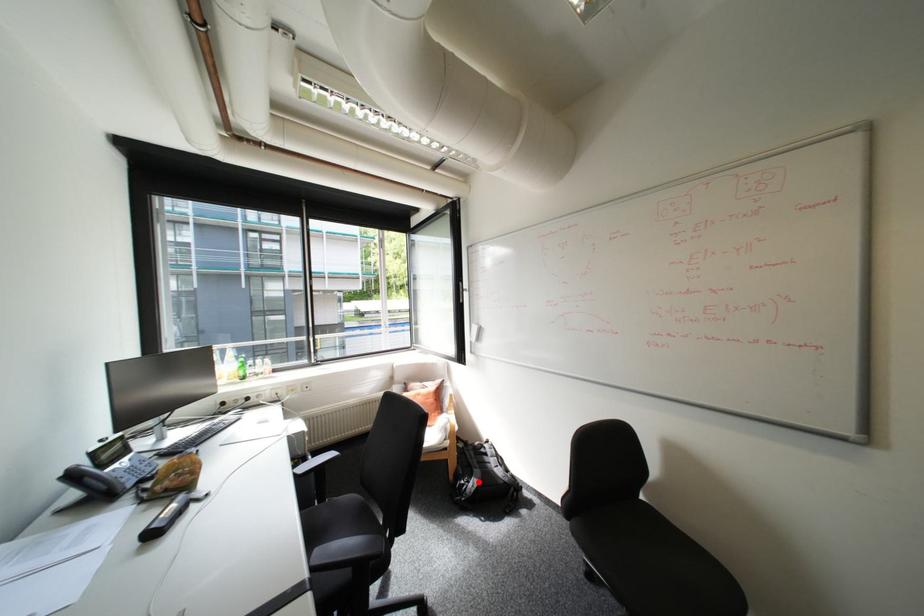
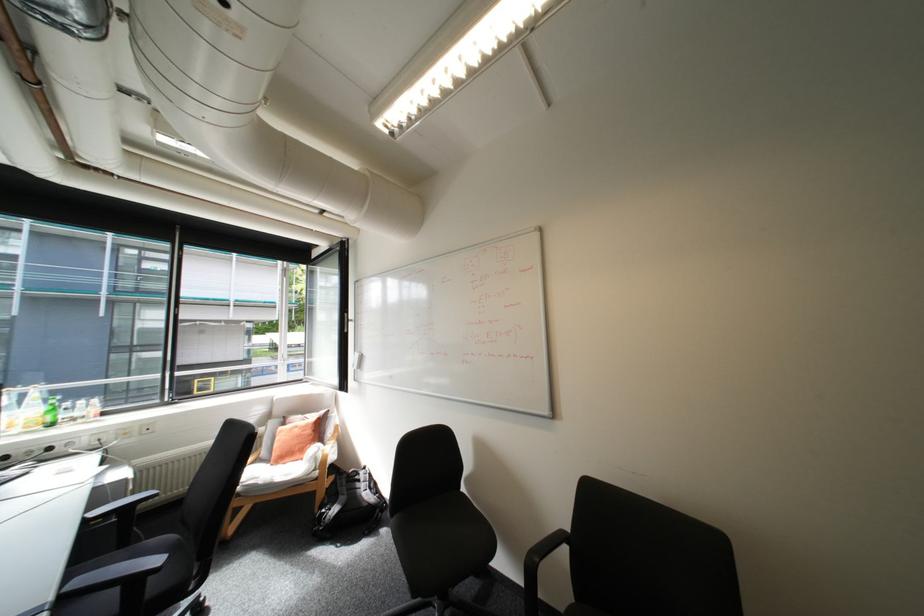
Locate, in the second image, the point that corresponds to the highlighted location in the first image.

(339, 509)